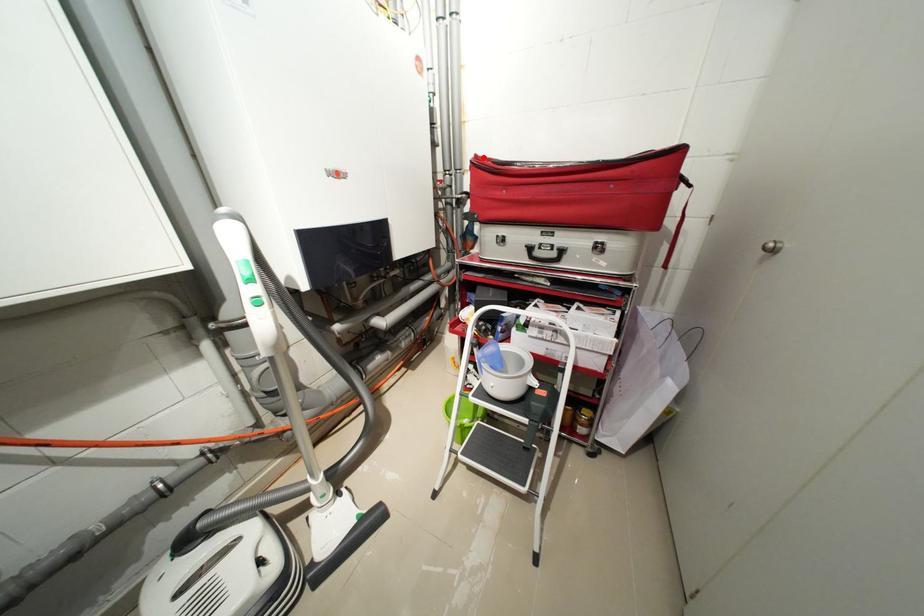
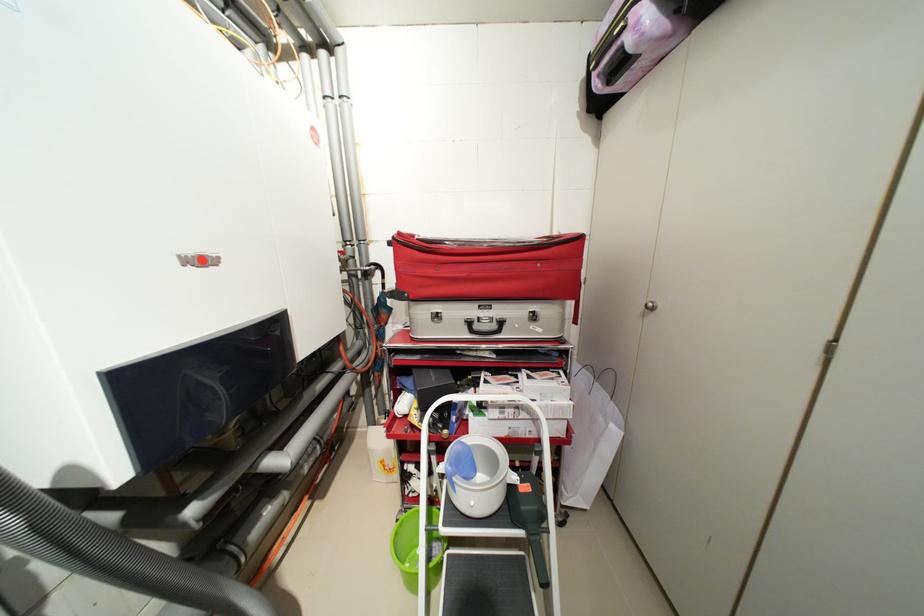
The point at the highlighted location is marked in the first image. Where is the corresponding point in the second image?

(407, 235)